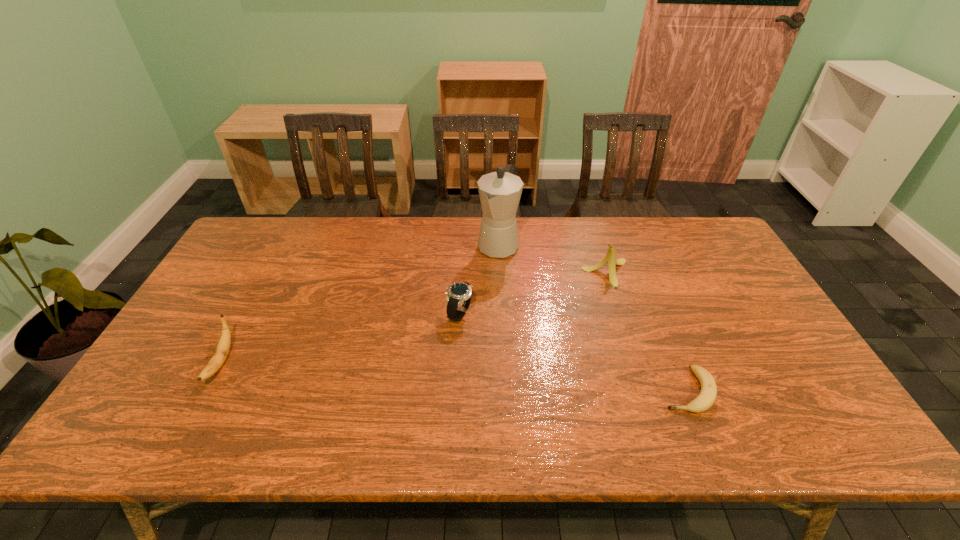
Locate an element on the screen. The height and width of the screenshot is (540, 960). coffeepot is located at coordinates (500, 191).

I want to click on the tallest object, so click(500, 191).

At what (x,y) coordinates should I click in order to perform the action: click on the tallest banana. Please return your answer as a coordinate pair (x, y). Looking at the image, I should click on (610, 258).

This screenshot has height=540, width=960. I want to click on the farthest banana, so click(610, 258).

Locate an element on the screen. the third farthest object is located at coordinates (459, 294).

Where is `watch`? The image size is (960, 540). watch is located at coordinates (459, 294).

Locate an element on the screen. Image resolution: width=960 pixels, height=540 pixels. the leftmost banana is located at coordinates (223, 346).

Find the location of a particular element. Image resolution: width=960 pixels, height=540 pixels. the second tallest banana is located at coordinates (223, 346).

What are the coordinates of `the shortest banana` in the screenshot? It's located at (707, 396).

Locate an element on the screen. The width and height of the screenshot is (960, 540). blank space located 0.080m on the right of the tallest object is located at coordinates (542, 245).